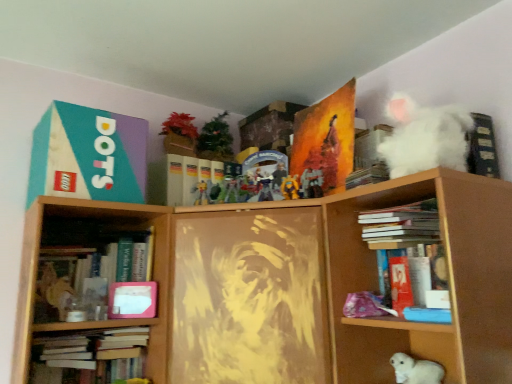
Question: Is orange matte painting at upper center, acting as the second paperback book starting from the left, in front of hardcover book at left, the second book when ordered from left to right?

Choices:
 (A) yes
 (B) no

Answer: (B)

Question: From the image's perspective, is orange matte painting at upper center, which is the first paperback book from right to left, beneath hardcover book at left, the 4th book viewed from the top?

Choices:
 (A) yes
 (B) no

Answer: (B)

Question: Can you confirm if orange matte painting at upper center, acting as the second paperback book starting from the left, is thinner than hardcover book at left, the 2th book ordered from the bottom?

Choices:
 (A) no
 (B) yes

Answer: (B)

Question: Does orange matte painting at upper center, which is the first paperback book from right to left, turn towards hardcover book at left, which ranks as the 4th book in right-to-left order?

Choices:
 (A) no
 (B) yes

Answer: (B)

Question: Does orange matte painting at upper center, acting as the second paperback book starting from the left, touch hardcover book at left, the 2th book ordered from the bottom?

Choices:
 (A) yes
 (B) no

Answer: (B)

Question: From the image's perspective, does orange matte painting at upper center, acting as the second paperback book starting from the left, appear higher than hardcover book at left, the 2th book ordered from the bottom?

Choices:
 (A) no
 (B) yes

Answer: (B)

Question: Is hardcover book at upper center, the 1th book from the top, further to the viewer compared to shiny plastic action figure at center, acting as the third toy starting from the front?

Choices:
 (A) no
 (B) yes

Answer: (A)

Question: Considering the relative sizes of hardcover book at upper center, the 1th book from the top, and shiny plastic action figure at center, placed as the second toy when sorted from left to right, in the image provided, is hardcover book at upper center, the 1th book from the top, wider than shiny plastic action figure at center, placed as the second toy when sorted from left to right,?

Choices:
 (A) yes
 (B) no

Answer: (A)

Question: From a real-world perspective, is hardcover book at upper center, which appears as the 2th book when viewed from the right, over shiny plastic action figure at center, the third toy positioned from the bottom?

Choices:
 (A) yes
 (B) no

Answer: (B)

Question: From a real-world perspective, is hardcover book at upper center, the 1th book from the top, beneath shiny plastic action figure at center, the second toy positioned from the back?

Choices:
 (A) yes
 (B) no

Answer: (A)

Question: From the image's perspective, is hardcover book at upper center, acting as the fifth book starting from the bottom, below shiny plastic action figure at center, the second toy from the top?

Choices:
 (A) no
 (B) yes

Answer: (A)

Question: Considering the relative positions of hardcover book at upper center, the 1th book from the top, and shiny plastic action figure at center, placed as the second toy when sorted from left to right, in the image provided, is hardcover book at upper center, the 1th book from the top, to the right of shiny plastic action figure at center, placed as the second toy when sorted from left to right, from the viewer's perspective?

Choices:
 (A) yes
 (B) no

Answer: (A)

Question: Are yellow matte toy at center, placed as the 2th toy when sorted from right to left, and hardcover book at left, the 2th book ordered from the bottom, far apart?

Choices:
 (A) no
 (B) yes

Answer: (A)